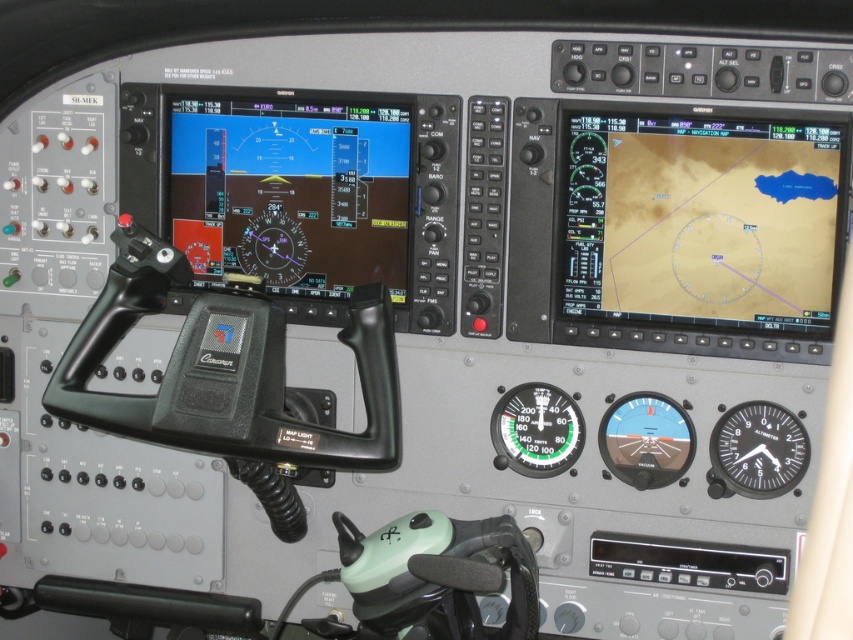
You are a pilot preparing for takeoff and need to check both the black glass altimeter at lower right and the matte black compass at center. Which instrument should you check first based on their positions?

The matte black compass at center should be checked first because the black glass altimeter at lower right is located below it, meaning the compass is higher up and more accessible in the cockpit layout.

You are a pilot preparing for takeoff and need to adjust the green matte gauge at center and the matte black compass at center. Which one do you need to reach first if you are sitting in the cockpit?

The green matte gauge at center is closer to the viewer than the matte black compass at center, so you should reach for the green matte gauge at center first.

You are a pilot sitting in the cockpit and need to reach two points in the instrument panel. The first point is at coordinate point (676, 410) and the second is at point (294, 259). Which point is closer to you?

Point (676, 410) is closer to the viewer than point (294, 259).